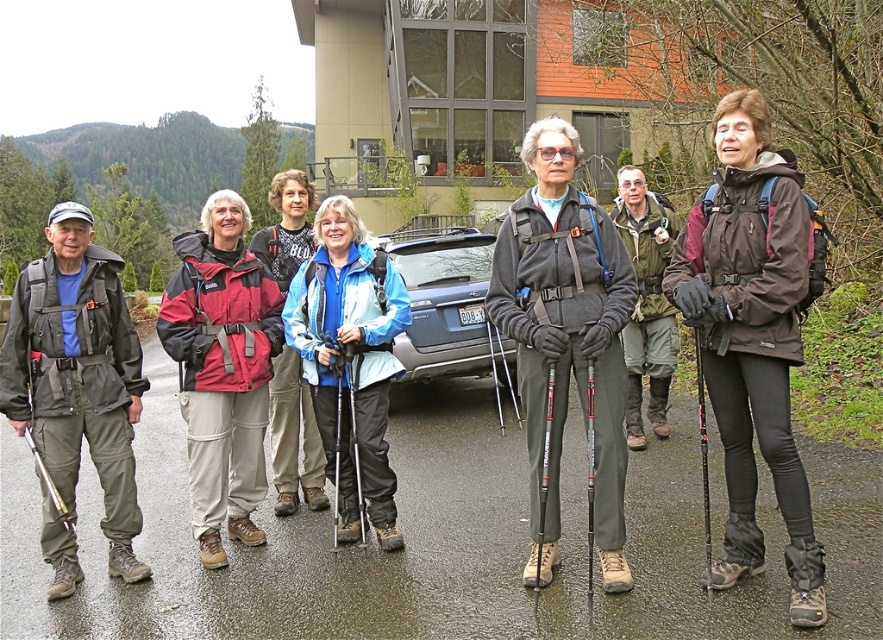
Who is positioned more to the left, blue/white fleece jacket at center or matte blue jacket at center?

matte blue jacket at center

Can you confirm if blue/white fleece jacket at center is positioned above matte blue jacket at center?

No.

Is point (368, 444) positioned after point (312, 188)?

No, it is in front of (312, 188).

At what (x,y) coordinates should I click in order to perform the action: click on blue/white fleece jacket at center. Please return your answer as a coordinate pair (x, y). The width and height of the screenshot is (883, 640). Looking at the image, I should click on (349, 360).

Between point (464, 360) and point (291, 440), which one is positioned behind?

Positioned behind is point (464, 360).

Based on the photo, which is below, metallic gray suv at center or matte blue jacket at center?

matte blue jacket at center is below.

Is point (474, 307) positioned in front of point (300, 186)?

No, it is not.

Find the location of `metallic gray suv at center`. metallic gray suv at center is located at coordinates (447, 305).

Is gray fleece jacket at center wider than blue/white fleece jacket at center?

No.

Is point (571, 246) more distant than point (355, 512)?

That is False.

At what (x,y) coordinates should I click in order to perform the action: click on gray fleece jacket at center. Please return your answer as a coordinate pair (x, y). This screenshot has width=883, height=640. Looking at the image, I should click on (565, 336).